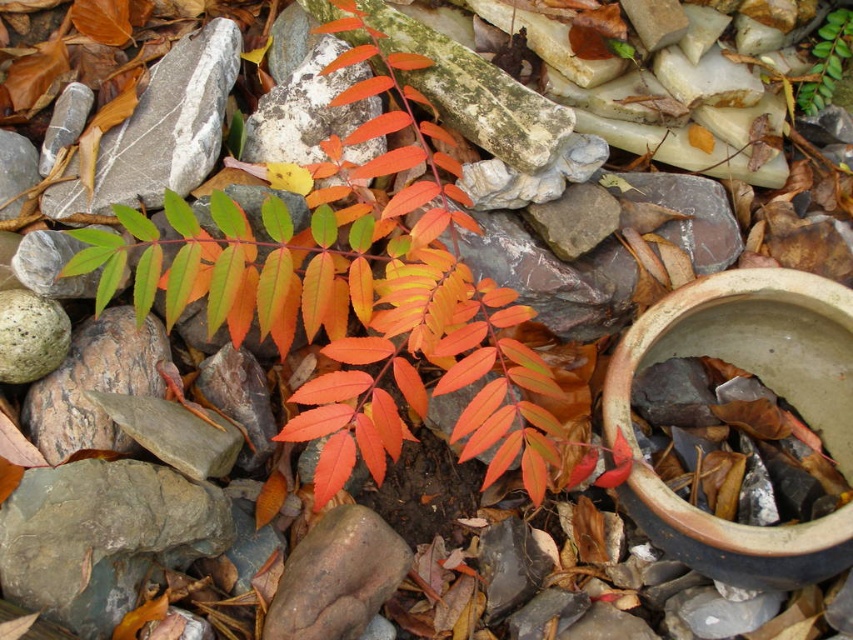
Question: Does bright orange leaves at center have a lesser width compared to orange matte leaf at center?

Choices:
 (A) no
 (B) yes

Answer: (A)

Question: Which of these objects is positioned closest to the bright orange leaves at center?

Choices:
 (A) smooth gray rock at center
 (B) green matte leaf at upper center

Answer: (A)

Question: Is smooth gray rock at center to the right of green matte leaf at upper center from the viewer's perspective?

Choices:
 (A) yes
 (B) no

Answer: (B)

Question: Which point is closer to the camera taking this photo?

Choices:
 (A) (345, 449)
 (B) (393, 58)
 (C) (300, 556)

Answer: (A)

Question: Which is nearer to the orange matte leaf at center?

Choices:
 (A) bright orange leaves at center
 (B) smooth gray rock at center

Answer: (A)

Question: Considering the relative positions of green matte leaf at upper center and orange matte leaf at center in the image provided, where is green matte leaf at upper center located with respect to orange matte leaf at center?

Choices:
 (A) below
 (B) above

Answer: (B)